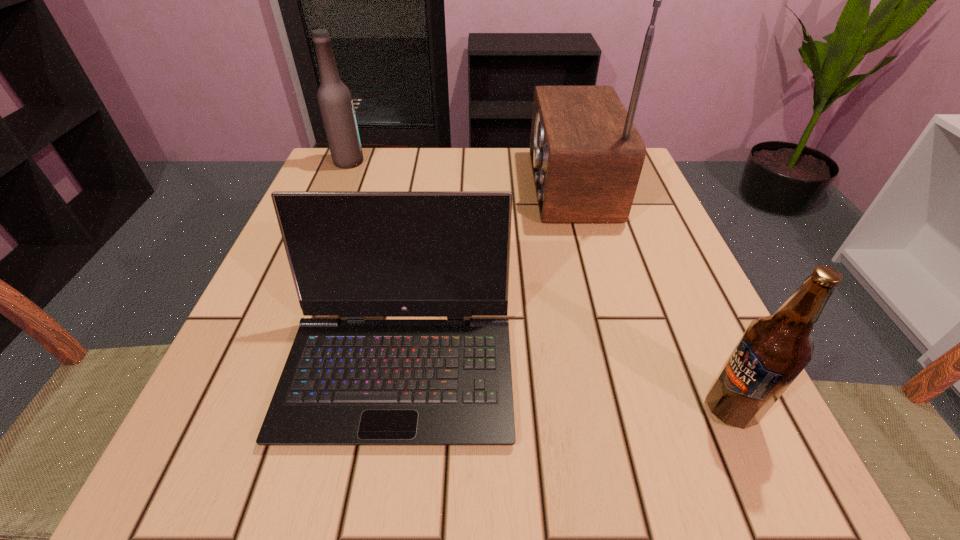
This screenshot has height=540, width=960. What are the coordinates of `radio receiver positioned at the right edge` in the screenshot? It's located at (586, 154).

This screenshot has height=540, width=960. Identify the location of beer bottle located at the right edge. (773, 351).

You are a GUI agent. You are given a task and a screenshot of the screen. Output one action in this format:
    pyautogui.click(x=<x>, y=<y>)
    Task: Click on the object located in the far left corner section of the desktop
    This screenshot has width=960, height=540.
    Given the screenshot: What is the action you would take?
    (x=335, y=102)

You are a GUI agent. You are given a task and a screenshot of the screen. Output one action in this format:
    pyautogui.click(x=<x>, y=<y>)
    Task: Click on the object situated at the near left corner
    The height and width of the screenshot is (540, 960).
    Given the screenshot: What is the action you would take?
    pyautogui.click(x=346, y=382)

Where is `object at the far right corner`? The width and height of the screenshot is (960, 540). object at the far right corner is located at coordinates (586, 154).

The image size is (960, 540). Identify the location of object present at the near right corner. (773, 351).

Where is `vacant space at the far edge`? The image size is (960, 540). vacant space at the far edge is located at coordinates (416, 166).

In the image, there is a desktop. Identify the location of vacant area at the near edge. The height and width of the screenshot is (540, 960). (620, 487).

This screenshot has width=960, height=540. I want to click on vacant space at the left edge of the desktop, so click(252, 323).

In the image, there is a desktop. Where is `vacant space at the right edge`? This screenshot has height=540, width=960. vacant space at the right edge is located at coordinates coord(664,249).